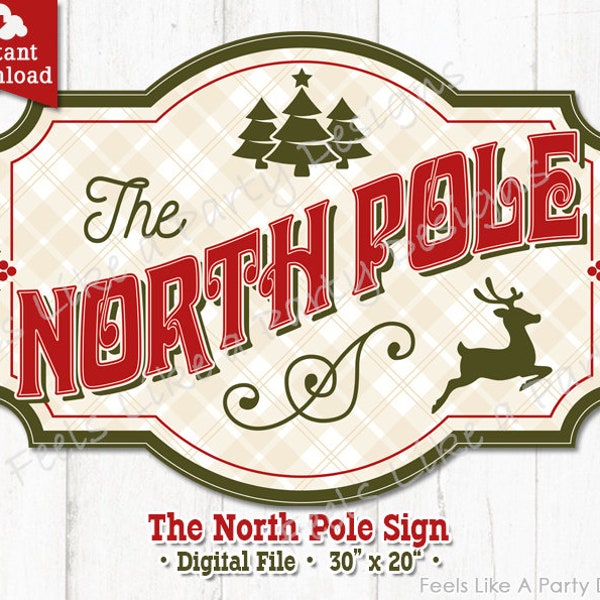
The height and width of the screenshot is (600, 600). Identify the location of wall behind painting. (466, 42).